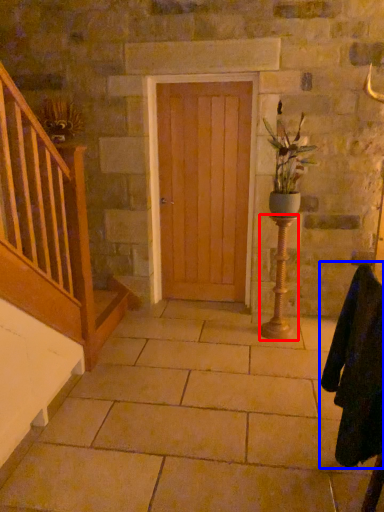
Question: Which of the following is the farthest to the observer, candle holder (highlighted by a red box) or robe (highlighted by a blue box)?

Choices:
 (A) candle holder
 (B) robe

Answer: (A)